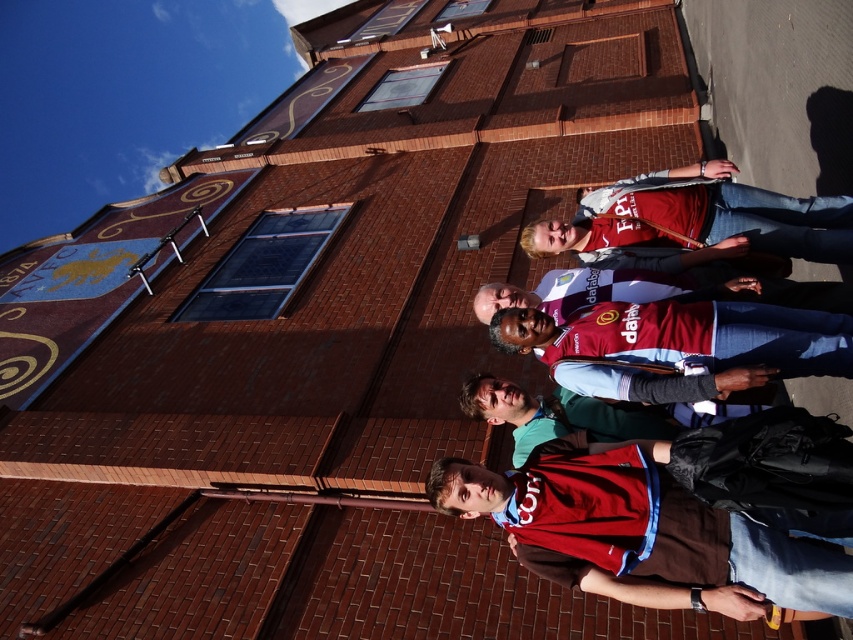
In the scene shown: Who is higher up, matte red jersey at center or matte red shirt at center?

matte red shirt at center is higher up.

Is point (804, 552) positioned after point (787, 246)?

That is False.

The width and height of the screenshot is (853, 640). What do you see at coordinates (646, 529) in the screenshot? I see `matte red jersey at center` at bounding box center [646, 529].

At what (x,y) coordinates should I click in order to perform the action: click on matte red jersey at center. Please return your answer as a coordinate pair (x, y). Looking at the image, I should click on (646, 529).